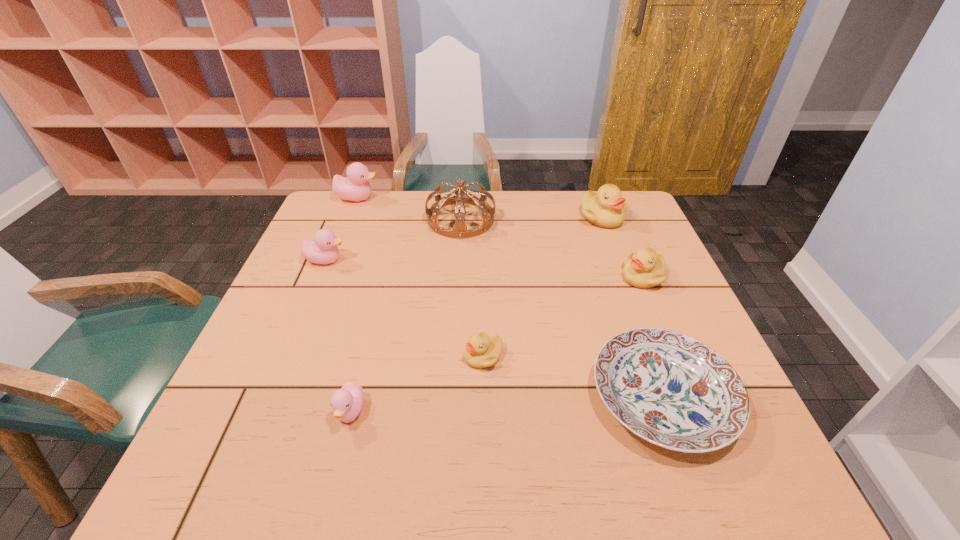
Find the location of a particular element. The width and height of the screenshot is (960, 540). brown tiara is located at coordinates (459, 231).

Image resolution: width=960 pixels, height=540 pixels. What are the coordinates of `the farthest pink duckling` in the screenshot? It's located at (355, 187).

Find the location of a particular element. The width and height of the screenshot is (960, 540). the biggest yellow duckling is located at coordinates (606, 208).

Image resolution: width=960 pixels, height=540 pixels. In order to click on the second smallest pink duckling in this screenshot , I will do `click(323, 249)`.

Identify the location of the second smallest yellow duckling. (645, 269).

Identify the location of the smallest pink duckling. The width and height of the screenshot is (960, 540). (346, 402).

Identify the location of the fourth duckling from right to left. (346, 402).

Locate an element on the screen. the leftmost yellow duckling is located at coordinates (482, 351).

This screenshot has width=960, height=540. Identify the location of the third duckling from right to left. (482, 351).

I want to click on plate, so click(670, 389).